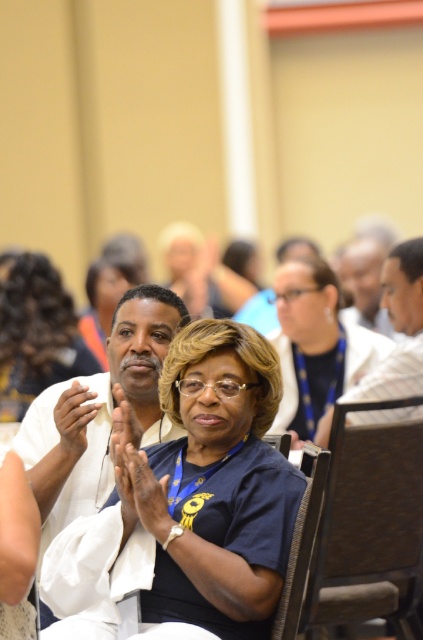
Can you confirm if blue fabric shirt at center is bigger than white fabric shirt at center?

Yes.

Locate an element on the screen. Image resolution: width=423 pixels, height=640 pixels. blue fabric shirt at center is located at coordinates (195, 496).

Who is more distant from viewer, (348, 324) or (10, 298)?

Point (10, 298)

Does point (302, 284) come closer to viewer compared to point (24, 352)?

Yes.

Find the location of a particular element. Image resolution: width=423 pixels, height=640 pixels. matte black shirt at center is located at coordinates (315, 346).

Who is shorter, matte black shirt at center or matte white shirt at center?

matte white shirt at center

Can you confirm if matte black shirt at center is thinner than matte white shirt at center?

No.

What do you see at coordinates (315, 346) in the screenshot? This screenshot has width=423, height=640. I see `matte black shirt at center` at bounding box center [315, 346].

Identify the location of matte black shirt at center. (315, 346).